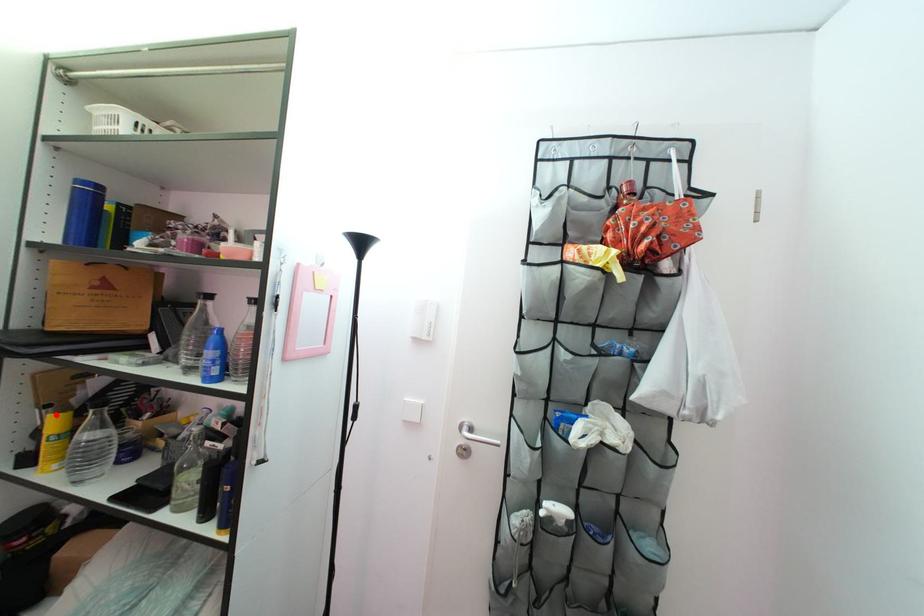
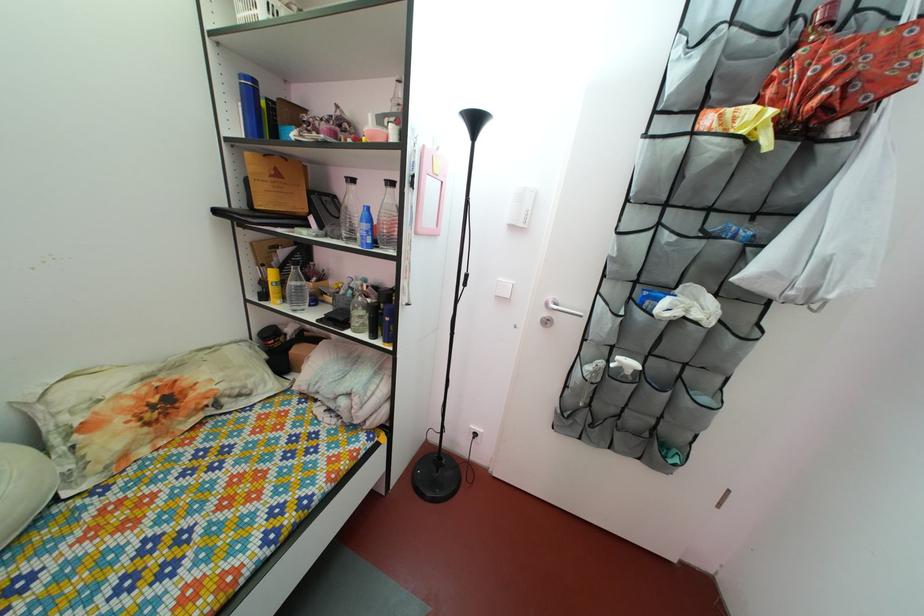
Question: I am providing you with two images of the same scene from different viewpoints. In image1, a red point is highlighted. Considering the same 3D point in image2, which of the following is correct?

Choices:
 (A) It is closer
 (B) It is farther

Answer: (B)